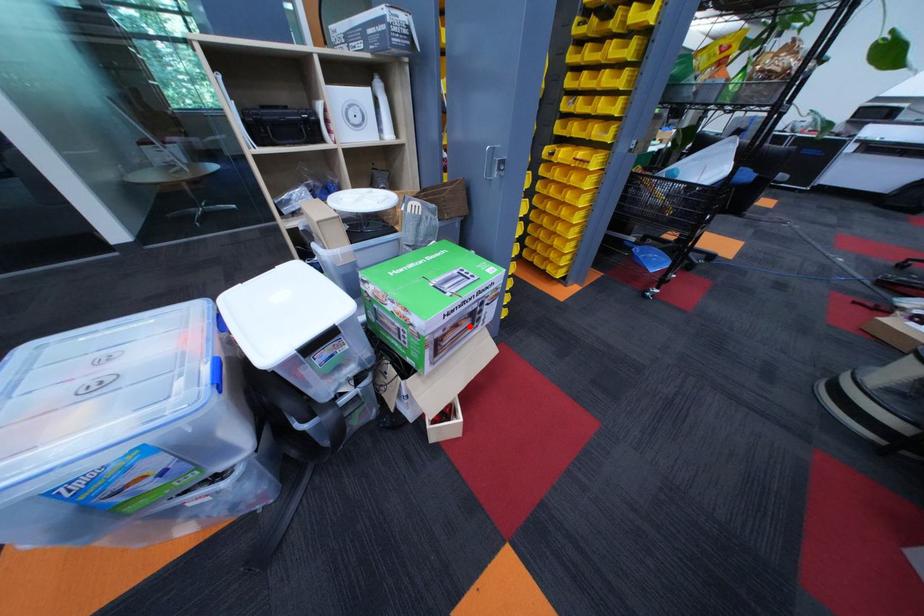
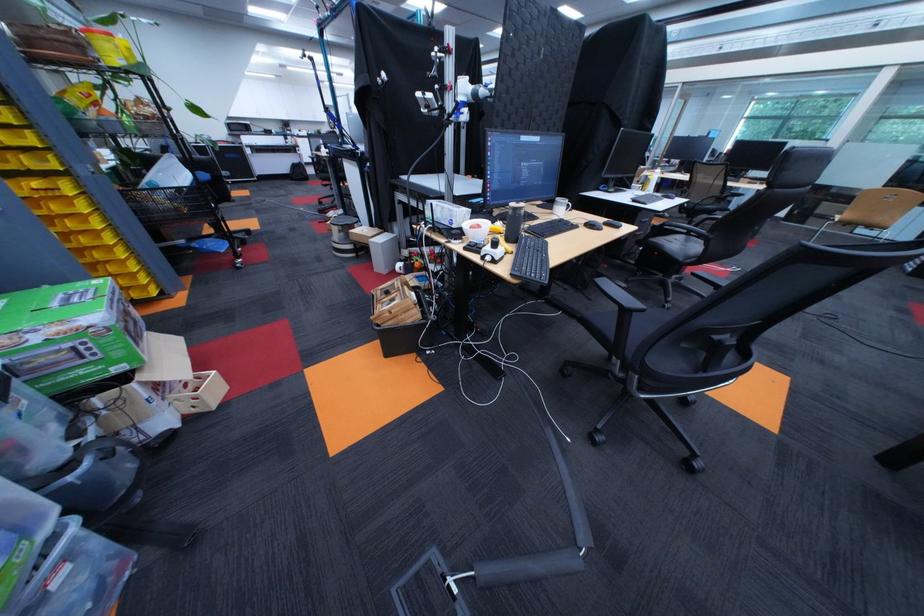
Question: I am providing you with two images of the same scene from different viewpoints. In image1, a red point is highlighted. Considering the same 3D point in image2, which of the following is correct?

Choices:
 (A) It is closer
 (B) It is farther

Answer: (B)